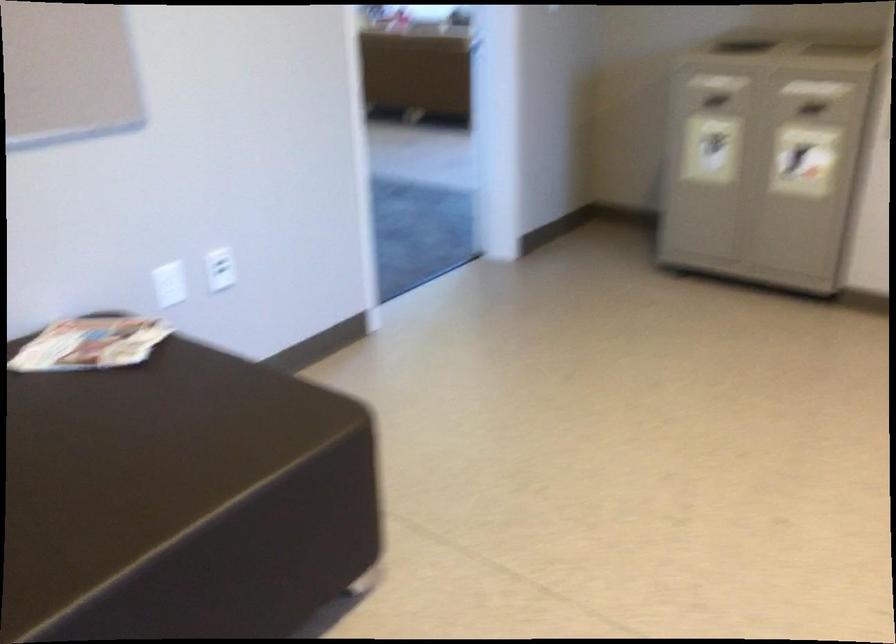
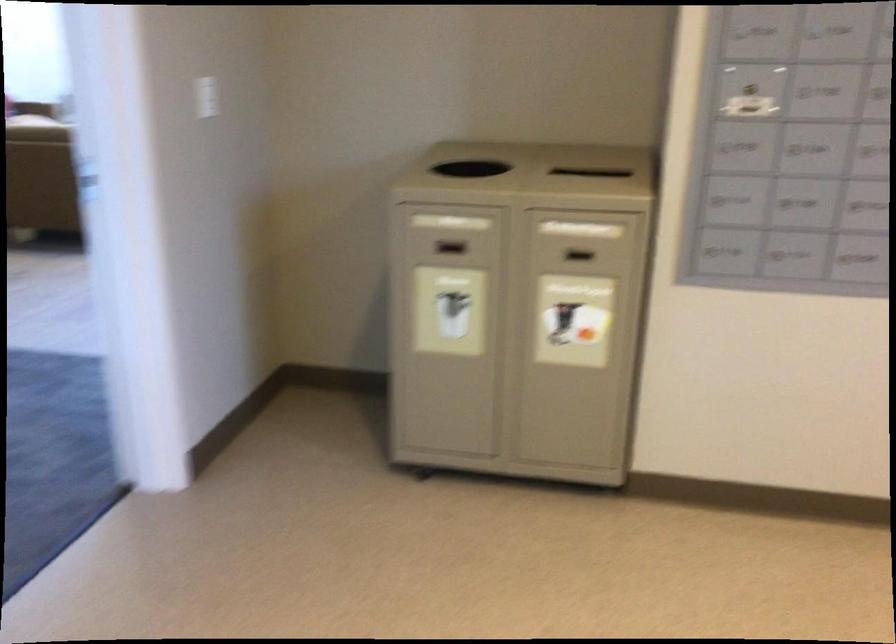
Question: What movement of the cameraman would produce the second image?

Choices:
 (A) Left
 (B) Right
 (C) Forward
 (D) Backward

Answer: (C)